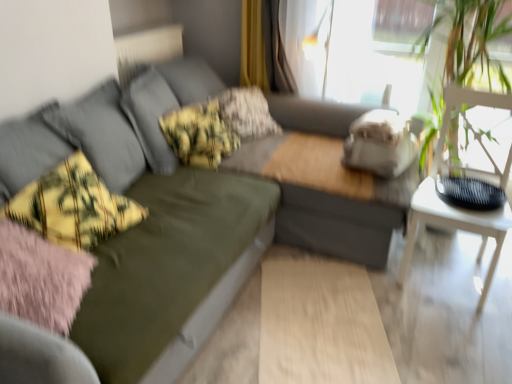
Locate an element on the screen. This screenshot has height=384, width=512. free space below white wooden table at right (from a real-world perspective) is located at coordinates (443, 271).